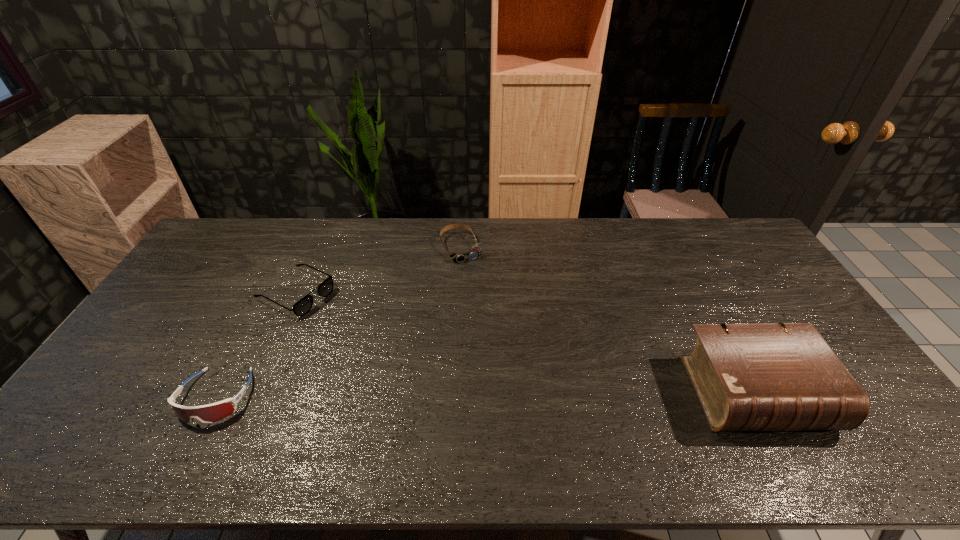
In order to click on vacant region at the left edge in this screenshot , I will do `click(204, 259)`.

This screenshot has height=540, width=960. In the image, there is a desktop. Identify the location of free space at the far right corner. (705, 238).

This screenshot has width=960, height=540. Find the location of `free space between the Bible and the taller goggles`. free space between the Bible and the taller goggles is located at coordinates (486, 395).

The width and height of the screenshot is (960, 540). I want to click on unoccupied area between the tallest object and the second farthest object, so click(526, 343).

Where is `vacant area between the second farthest object and the rightmost object`? The height and width of the screenshot is (540, 960). vacant area between the second farthest object and the rightmost object is located at coordinates click(x=526, y=343).

The width and height of the screenshot is (960, 540). I want to click on free space that is in between the second farthest object and the shorter goggles, so click(x=379, y=270).

What are the coordinates of `free point between the taller goggles and the farther goggles` in the screenshot? It's located at (339, 322).

Where is `free space between the farther goggles and the third nearest object`? The height and width of the screenshot is (540, 960). free space between the farther goggles and the third nearest object is located at coordinates coord(379,270).

Locate an element on the screen. This screenshot has width=960, height=540. vacant space that is in between the second farthest object and the left goggles is located at coordinates (256, 345).

This screenshot has height=540, width=960. In order to click on vacant point located between the left goggles and the third nearest object in this screenshot , I will do `click(256, 345)`.